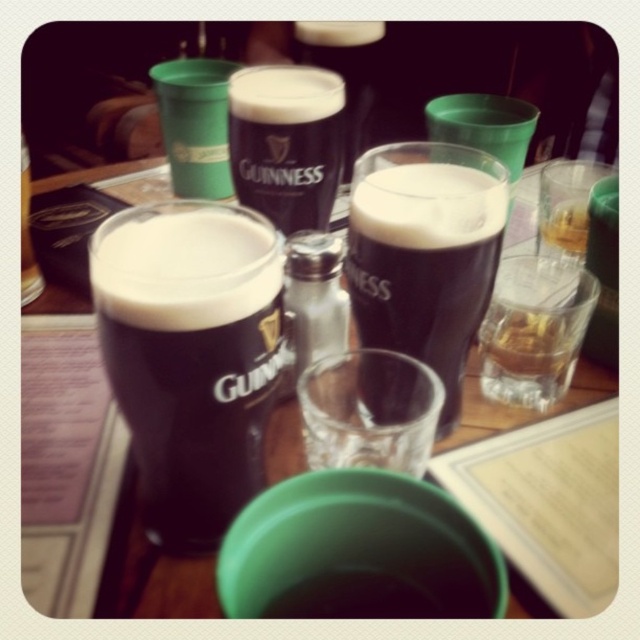
Question: Is the position of dark glass stout at center less distant than that of translucent glass at upper right?

Choices:
 (A) no
 (B) yes

Answer: (B)

Question: Does dark glass stout at center appear under translucent glass at center?

Choices:
 (A) no
 (B) yes

Answer: (B)

Question: Estimate the real-world distances between objects in this image. Which object is closer to the translucent glass at center?

Choices:
 (A) guinness stout glass at center
 (B) translucent glass at upper right

Answer: (B)

Question: Among these objects, which one is nearest to the camera?

Choices:
 (A) dark glass stout at center
 (B) translucent glass at center
 (C) guinness stout glass at center

Answer: (A)

Question: Is dark glass stout at center thinner than guinness stout glass at center?

Choices:
 (A) yes
 (B) no

Answer: (A)

Question: Considering the real-world distances, which object is farthest from the dark glass stout at center?

Choices:
 (A) guinness stout glass at center
 (B) translucent glass at center

Answer: (A)